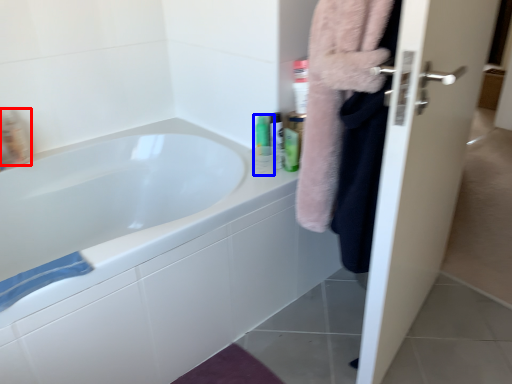
Question: Which of the following is the farthest to the observer, mouthwash (highlighted by a red box) or mouthwash (highlighted by a blue box)?

Choices:
 (A) mouthwash
 (B) mouthwash

Answer: (A)